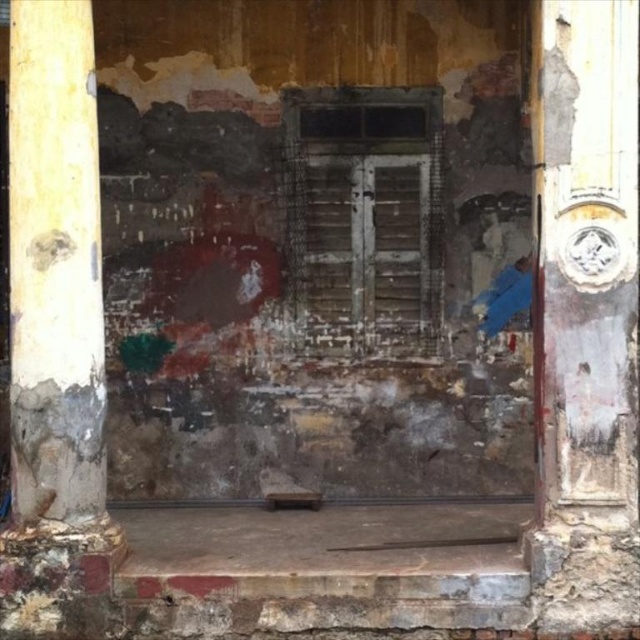
Question: Among these points, which one is farthest from the camera?

Choices:
 (A) (579, 4)
 (B) (58, 99)

Answer: (B)

Question: Is rusty metal door at right further to the viewer compared to weathered wood pillar at left?

Choices:
 (A) yes
 (B) no

Answer: (A)

Question: Does rusty metal door at right have a lesser width compared to weathered wood pillar at left?

Choices:
 (A) no
 (B) yes

Answer: (B)

Question: Is rusty metal door at right smaller than weathered wood pillar at left?

Choices:
 (A) yes
 (B) no

Answer: (A)

Question: Which point appears farthest from the camera in this image?

Choices:
 (A) (72, 472)
 (B) (564, 353)

Answer: (A)